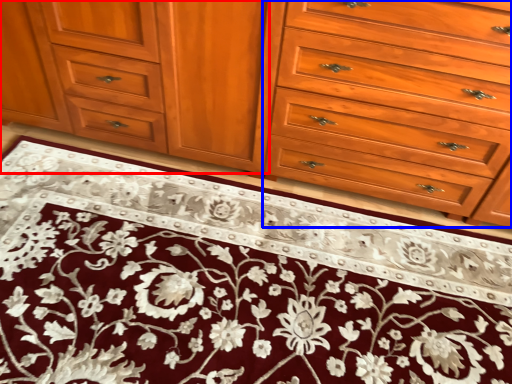
Question: Which of the following is the closest to the observer, cabinetry (highlighted by a red box) or drawer (highlighted by a blue box)?

Choices:
 (A) cabinetry
 (B) drawer

Answer: (B)